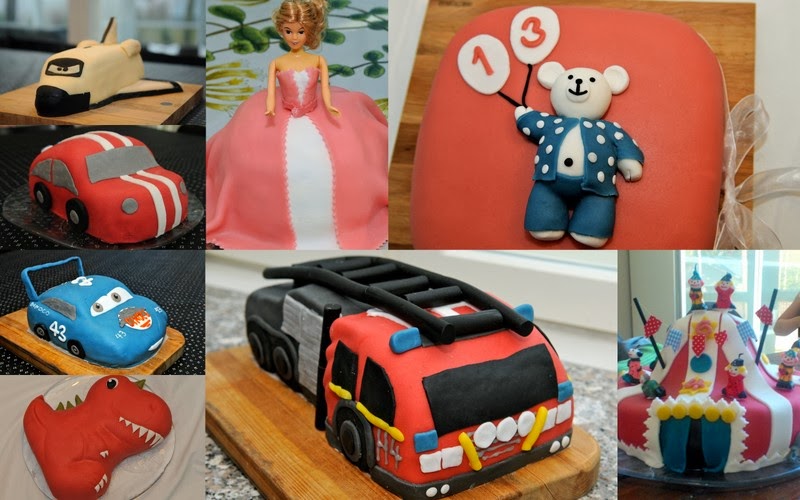
Identify the location of wooden cutting boards. (278, 446), (12, 331), (6, 100), (433, 34).